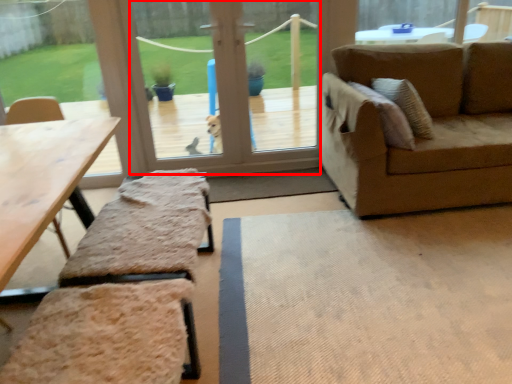
Question: From the image's perspective, where is window screen (annotated by the red box) located relative to picnic table?

Choices:
 (A) above
 (B) below

Answer: (A)